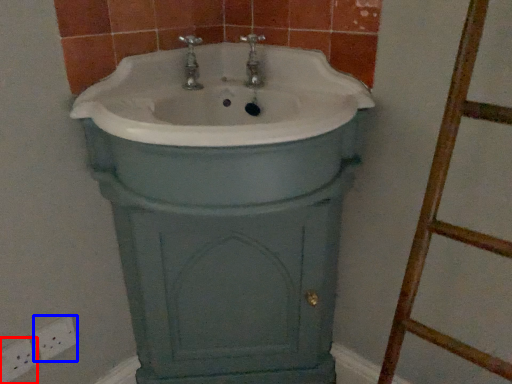
Question: Which of the following is the farthest to the observer, electric outlet (highlighted by a red box) or electric outlet (highlighted by a blue box)?

Choices:
 (A) electric outlet
 (B) electric outlet

Answer: (B)